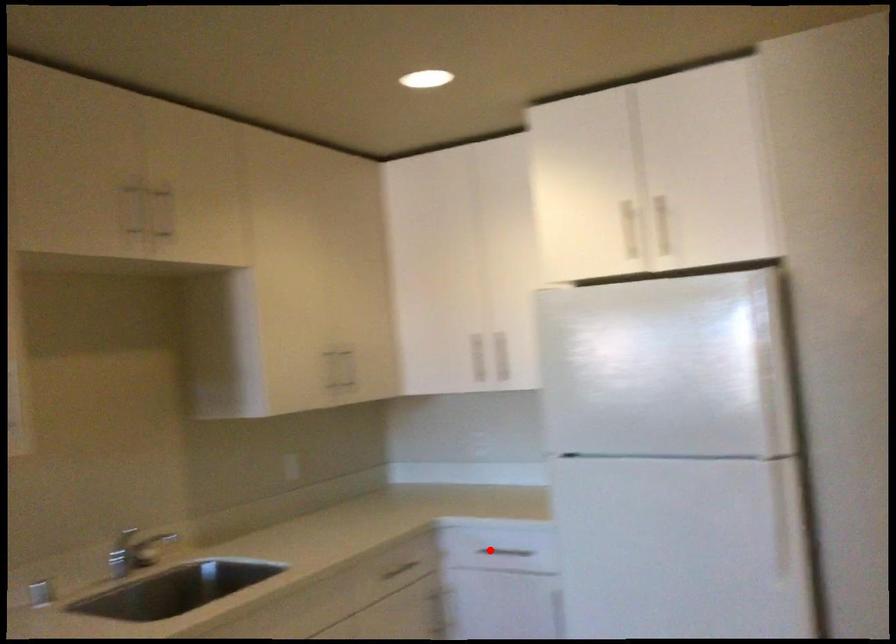
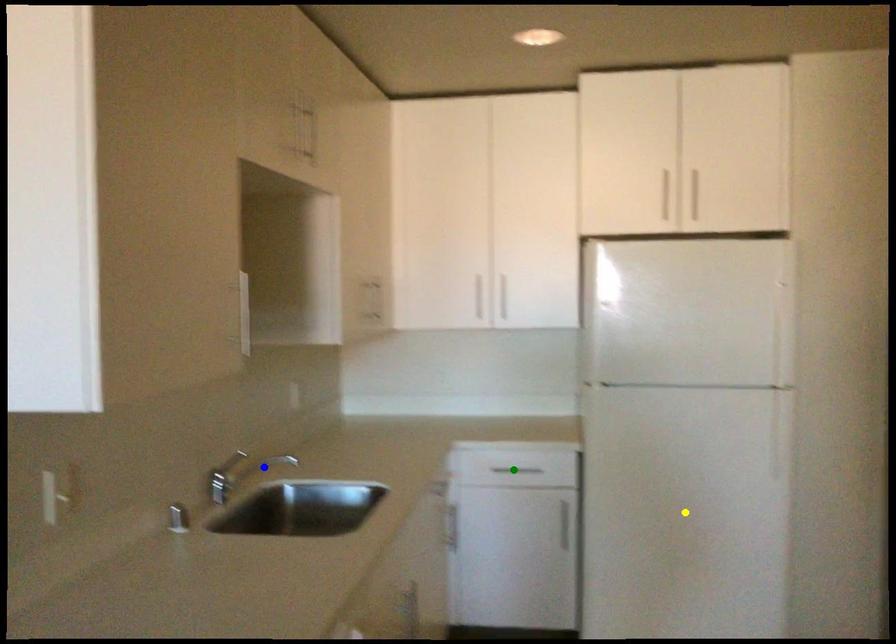
Question: I am providing you with two images of the same scene from different viewpoints. A red point is marked on the first image. You are given multiple points on the second image. Can you choose the point in image 2 that corresponds to the point in image 1?

Choices:
 (A) yellow point
 (B) green point
 (C) blue point

Answer: (B)